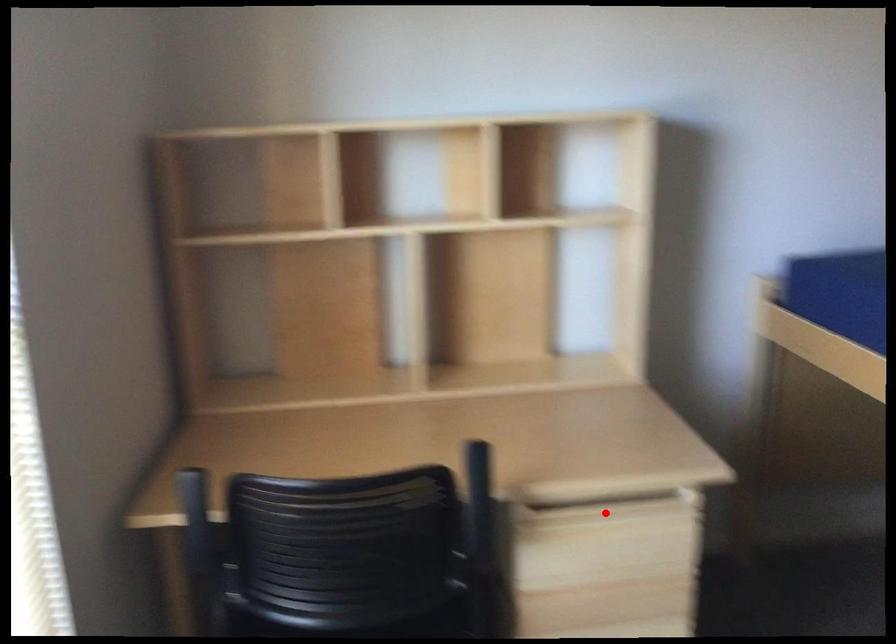
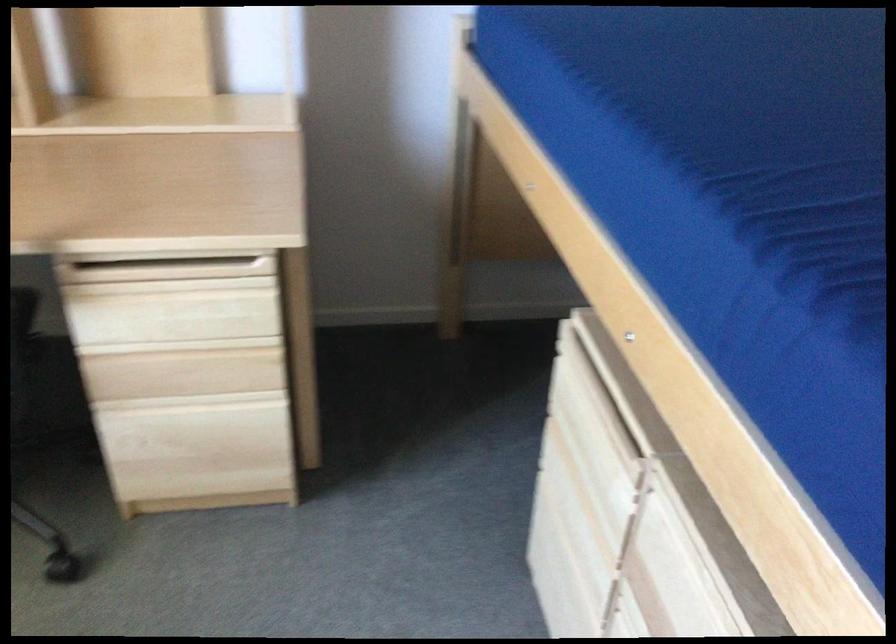
The point at the highlighted location is marked in the first image. Where is the corresponding point in the second image?

(166, 270)